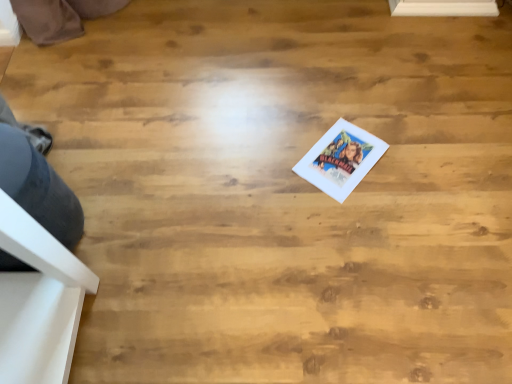
Question: Should I look upward or downward to see matte paper postcard at center?

Choices:
 (A) up
 (B) down

Answer: (A)

Question: From a real-world perspective, is matte paper postcard at center located beneath gray fabric shoe at lower left?

Choices:
 (A) no
 (B) yes

Answer: (B)

Question: Can you confirm if matte paper postcard at center is positioned to the right of gray fabric shoe at lower left?

Choices:
 (A) no
 (B) yes

Answer: (B)

Question: From the image's perspective, is matte paper postcard at center on gray fabric shoe at lower left?

Choices:
 (A) no
 (B) yes

Answer: (B)

Question: Considering the relative sizes of matte paper postcard at center and gray fabric shoe at lower left in the image provided, is matte paper postcard at center bigger than gray fabric shoe at lower left?

Choices:
 (A) yes
 (B) no

Answer: (B)

Question: Considering the relative sizes of matte paper postcard at center and gray fabric shoe at lower left in the image provided, is matte paper postcard at center smaller than gray fabric shoe at lower left?

Choices:
 (A) no
 (B) yes

Answer: (B)

Question: Is matte paper postcard at center outside of gray fabric shoe at lower left?

Choices:
 (A) yes
 (B) no

Answer: (A)

Question: Considering the relative sizes of gray fabric shoe at lower left and matte paper postcard at center in the image provided, is gray fabric shoe at lower left shorter than matte paper postcard at center?

Choices:
 (A) no
 (B) yes

Answer: (A)

Question: Can you confirm if gray fabric shoe at lower left is taller than matte paper postcard at center?

Choices:
 (A) no
 (B) yes

Answer: (B)

Question: From the image's perspective, is gray fabric shoe at lower left below matte paper postcard at center?

Choices:
 (A) yes
 (B) no

Answer: (A)

Question: Considering the relative sizes of gray fabric shoe at lower left and matte paper postcard at center in the image provided, is gray fabric shoe at lower left thinner than matte paper postcard at center?

Choices:
 (A) yes
 (B) no

Answer: (B)

Question: Is gray fabric shoe at lower left not inside matte paper postcard at center?

Choices:
 (A) yes
 (B) no

Answer: (A)

Question: From the image's perspective, is gray fabric shoe at lower left on matte paper postcard at center?

Choices:
 (A) yes
 (B) no

Answer: (B)

Question: From a real-world perspective, is matte paper postcard at center physically located above or below gray fabric shoe at lower left?

Choices:
 (A) below
 (B) above

Answer: (A)